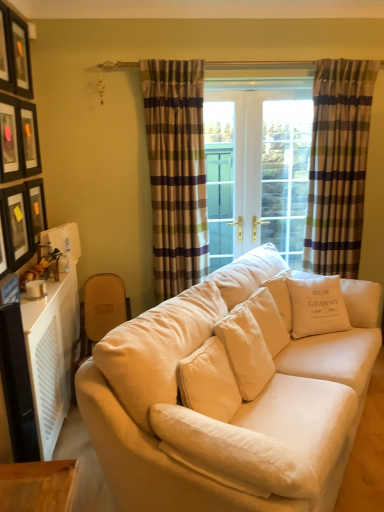
Question: Considering the positions of plaid fabric curtain at center, which ranks as the 1th curtain in left-to-right order, and matte black picture frame at upper left, the 1th picture frame positioned from the bottom, in the image, is plaid fabric curtain at center, which ranks as the 1th curtain in left-to-right order, taller or shorter than matte black picture frame at upper left, the 1th picture frame positioned from the bottom,?

Choices:
 (A) tall
 (B) short

Answer: (A)

Question: Considering their positions, is plaid fabric curtain at center, which ranks as the 1th curtain in left-to-right order, located in front of or behind matte black picture frame at upper left, the 1th picture frame positioned from the bottom?

Choices:
 (A) behind
 (B) front

Answer: (A)

Question: Which object is the farthest from the matte black picture frame at upper left, the 1th picture frame when ordered from top to bottom?

Choices:
 (A) matte black picture frame at upper left, placed as the 3th picture frame when sorted from top to bottom
 (B) white cotton cushion at center, acting as the 1th pillow starting from the right
 (C) plaid fabric curtain at right, which is the first curtain from right to left
 (D) matte black picture frame at upper left, the 1th picture frame positioned from the bottom
 (E) matte black picture frame at upper left, the second picture frame positioned from the bottom

Answer: (B)

Question: Based on their relative distances, which object is nearer to the matte black picture frame at upper left, arranged as the fifth picture frame when ordered from the bottom?

Choices:
 (A) matte black picture frame at upper left, placed as the 3th picture frame when sorted from top to bottom
 (B) plaid fabric curtain at right, the second curtain in the left-to-right sequence
 (C) matte black picture frame at upper left, which appears as the fifth picture frame when viewed from the top
 (D) white plastic radiator at lower left
 (E) white soft cushion at center, acting as the 1th pillow starting from the left

Answer: (A)